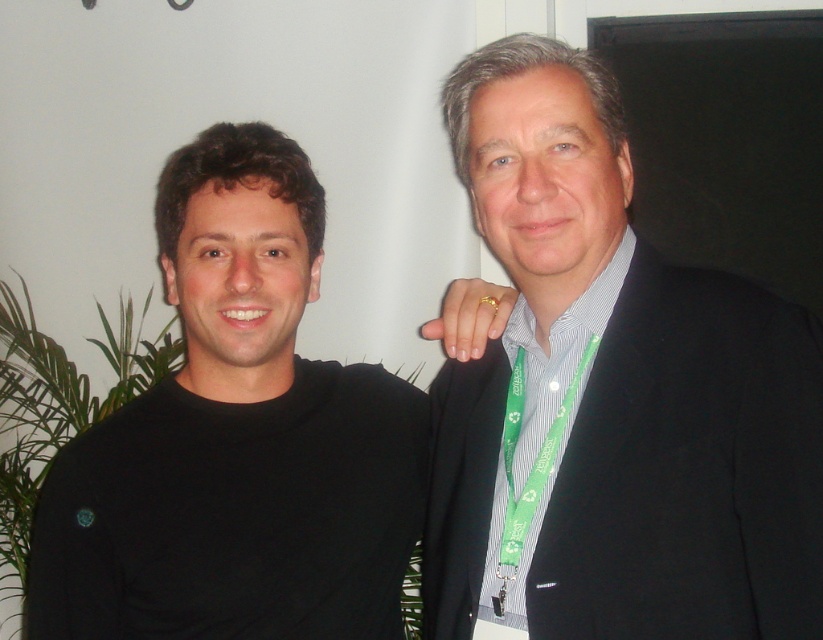
You are organizing a photo shoot and need to ensure that the black matte shirt at left and the black wool suit at right are positioned so that neither overlaps. Given their potential widths, what should you consider when placing them?

You should consider the width of the black matte shirt at left and black wool suit at right, as the black matte shirt at left might be wider than the black wool suit at right, so they need to be spaced appropriately to avoid overlapping.

You are a photographer adjusting your camera settings to focus on two specific points in the image. The first point is point [266,256] and the second is point [638,276]. Which point should you focus on first to ensure proper depth of field?

Point [266,256] should be focused on first because it is closer to the viewer than point [638,276], ensuring the foreground is sharp before adjusting for the background.

You are a photographer who needs to adjust the lighting between the black matte shirt at left and the black wool suit at right. Since the two objects are 11.06 inches apart, what is the minimum distance you should set your camera to focus on both clearly?

The minimum focusing distance should be at least 11.06 inches to ensure both the black matte shirt at left and the black wool suit at right are in focus.